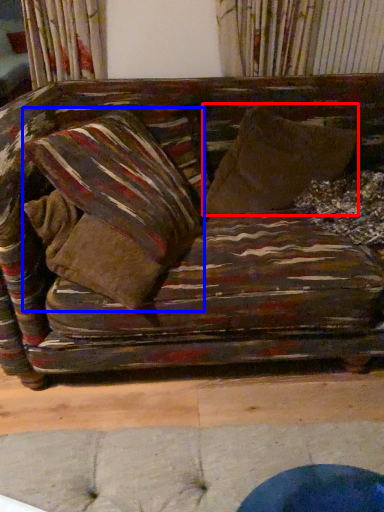
Question: Which object appears farthest to the camera in this image, throw pillow (highlighted by a red box) or pillow (highlighted by a blue box)?

Choices:
 (A) throw pillow
 (B) pillow

Answer: (A)